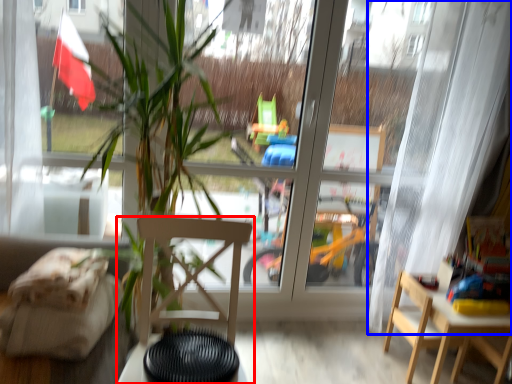
Question: Which of the following is the farthest to the observer, chair (highlighted by a red box) or curtain (highlighted by a blue box)?

Choices:
 (A) chair
 (B) curtain

Answer: (B)